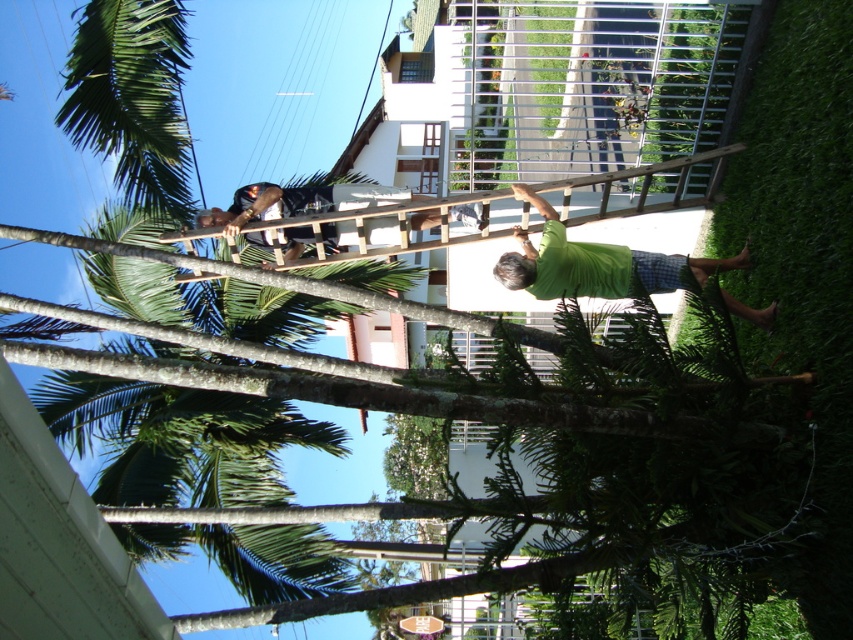
This screenshot has width=853, height=640. What do you see at coordinates (593, 262) in the screenshot? I see `green matte shirt at lower right` at bounding box center [593, 262].

In order to click on green matte shirt at lower right in this screenshot , I will do pyautogui.click(x=593, y=262).

Identify the location of green matte shirt at lower right. (593, 262).